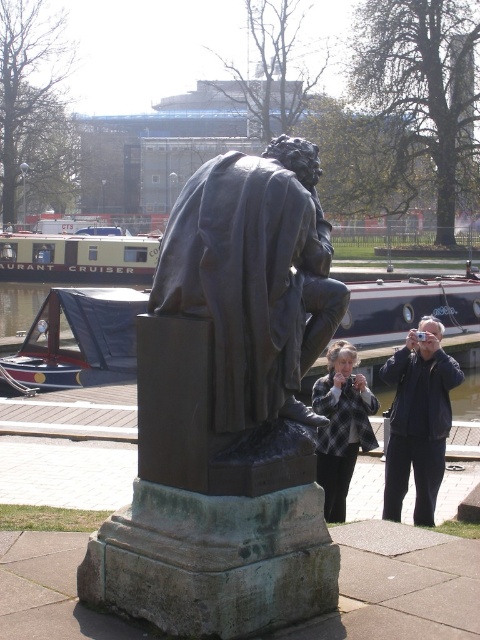
You are standing at the entrance of the park and want to take a photo of the bronze statue at center. Given that the statue is at coordinates approximately 0.434 on the x and 0.529 on the y axis, would you position yourself to the left or right of the statue to frame it best in your camera viewfinder?

The bronze statue at center is located at point (253, 276), so positioning yourself to the right of the statue would allow better framing as the coordinates suggest it is closer to the left side of the scene.

You are a photographer wanting to capture both the dark blue jacket at center and the plaid fabric jacket at center in a single frame. Based on their positions, can you tell which jacket you need to focus on first to ensure both are in focus?

The plaid fabric jacket at center is behind the dark blue jacket at center, so you should focus on the dark blue jacket at center first to ensure both are in focus.

You are a tailor observing the statue and the jackets in the scene. You need to determine which jacket is larger in height between the dark blue jacket at center and the plaid fabric jacket at center. Based on the scene, which one is taller?

The dark blue jacket at center is taller than the plaid fabric jacket at center.